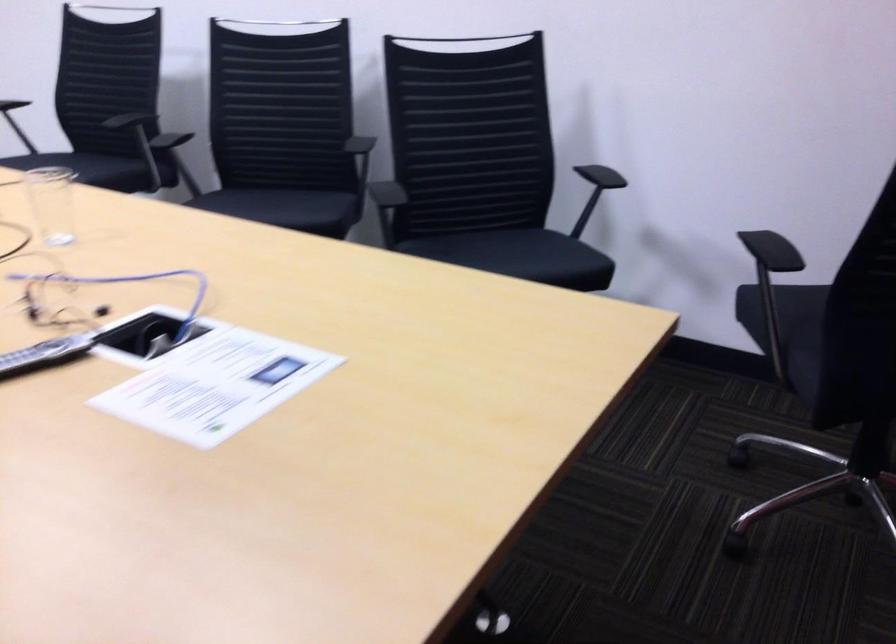
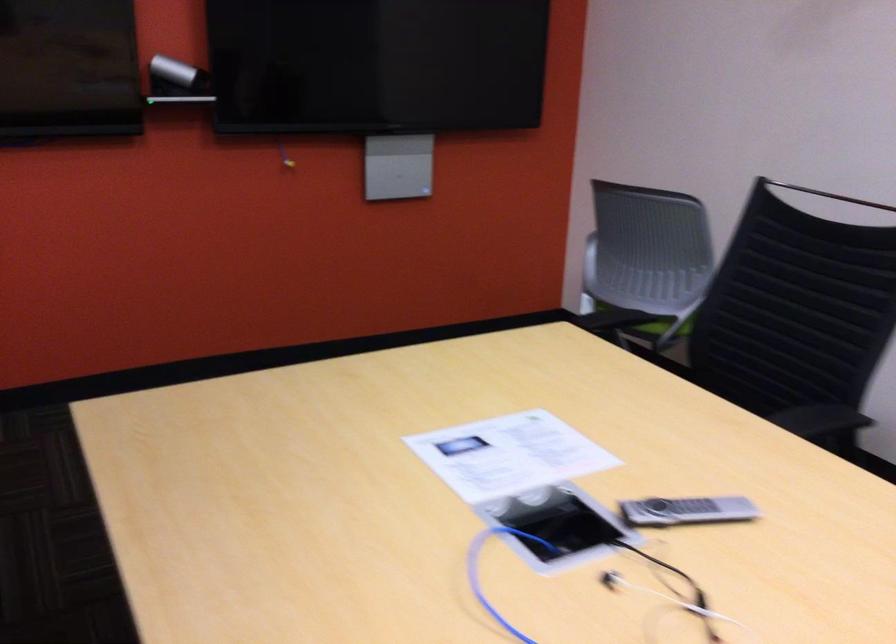
In the second image, find the point that corresponds to the point at 125,308 in the first image.

(576, 583)